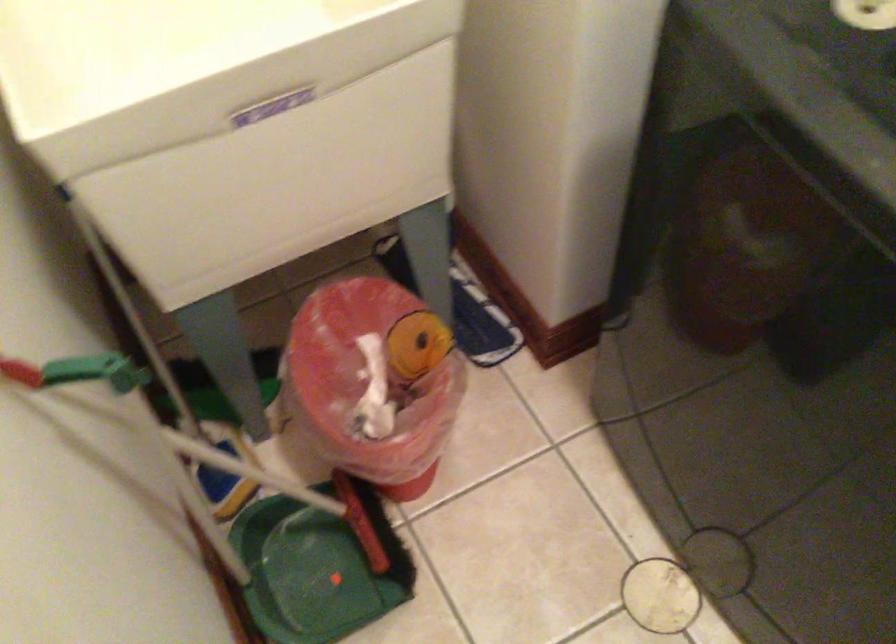
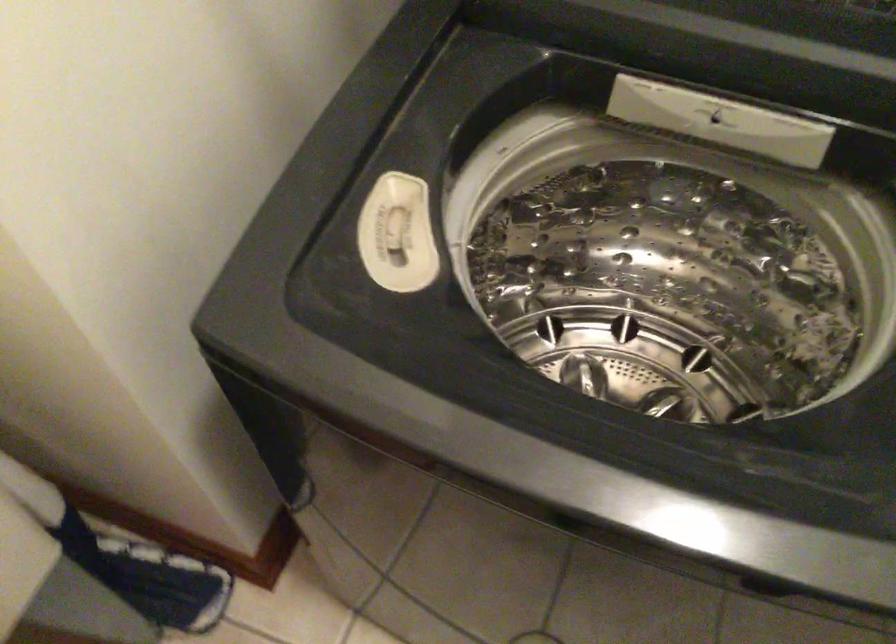
Question: The first image is from the beginning of the video and the second image is from the end. How did the camera likely rotate when shooting the video?

Choices:
 (A) Left
 (B) Right
 (C) Up
 (D) Down

Answer: (B)